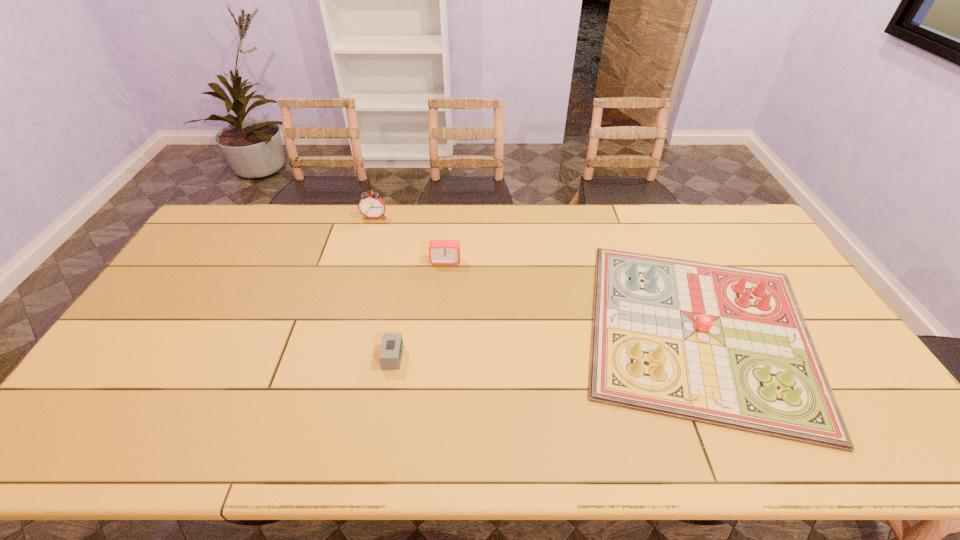
You are a GUI agent. You are given a task and a screenshot of the screen. Output one action in this format:
    pyautogui.click(x=<x>, y=<y>)
    Task: Click on the vacant space at the far left corner of the desktop
    This screenshot has height=540, width=960.
    Given the screenshot: What is the action you would take?
    pyautogui.click(x=245, y=222)

In the image, there is a desktop. Where is `vacant area at the far right corner`? vacant area at the far right corner is located at coordinates (744, 238).

The width and height of the screenshot is (960, 540). I want to click on vacant space at the near right corner, so click(x=880, y=434).

Find the location of `vacant area that lies between the second nearest alarm clock and the farthest object`. vacant area that lies between the second nearest alarm clock and the farthest object is located at coordinates (410, 239).

Where is `free spot between the farthest object and the shortest alarm clock`? Image resolution: width=960 pixels, height=540 pixels. free spot between the farthest object and the shortest alarm clock is located at coordinates point(384,287).

I want to click on empty space that is in between the second alarm clock from right to left and the gameboard, so click(x=546, y=343).

The height and width of the screenshot is (540, 960). Identify the location of empty space that is in between the leftmost object and the shortest alarm clock. (384, 287).

Locate an element on the screen. This screenshot has height=540, width=960. free space between the leftmost alarm clock and the nearest alarm clock is located at coordinates (384, 287).

Where is `unoccupied position between the farthest object and the third object from left to right`? The width and height of the screenshot is (960, 540). unoccupied position between the farthest object and the third object from left to right is located at coordinates (410, 239).

You are a GUI agent. You are given a task and a screenshot of the screen. Output one action in this format:
    pyautogui.click(x=<x>, y=<y>)
    Task: Click on the vacant space in between the second object from right to left and the second alarm clock from right to left
    This screenshot has width=960, height=540.
    Given the screenshot: What is the action you would take?
    pyautogui.click(x=420, y=309)